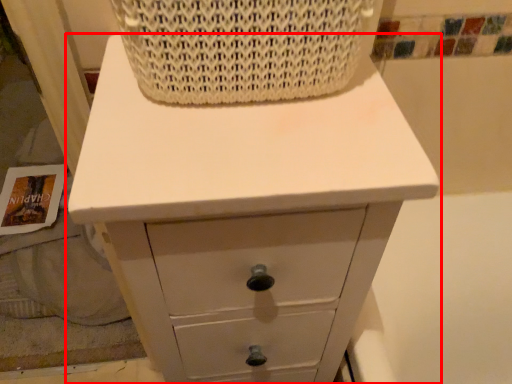
Question: In this image, where is chest of drawers (annotated by the red box) located relative to basket?

Choices:
 (A) right
 (B) left

Answer: (B)